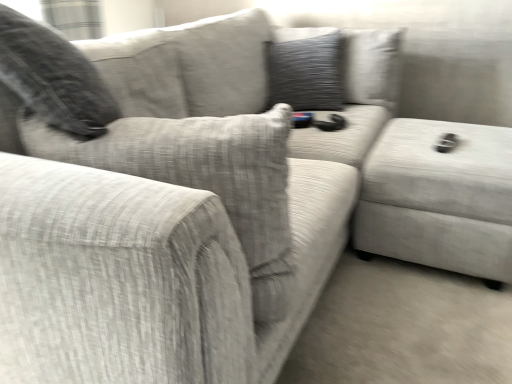
Question: From the image's perspective, is textured gray pillow at upper center beneath textured fabric ottoman at right?

Choices:
 (A) no
 (B) yes

Answer: (A)

Question: Does textured gray pillow at upper center have a greater height compared to textured fabric ottoman at right?

Choices:
 (A) no
 (B) yes

Answer: (B)

Question: Is textured gray pillow at upper center oriented away from textured fabric ottoman at right?

Choices:
 (A) yes
 (B) no

Answer: (B)

Question: Is textured gray pillow at upper center surrounding textured fabric ottoman at right?

Choices:
 (A) no
 (B) yes

Answer: (A)

Question: Does textured gray pillow at upper center have a smaller size compared to textured fabric ottoman at right?

Choices:
 (A) yes
 (B) no

Answer: (A)

Question: Could you tell me if textured gray pillow at upper center is facing textured fabric ottoman at right?

Choices:
 (A) no
 (B) yes

Answer: (A)

Question: Is textured fabric ottoman at right taller than textured gray pillow at upper center?

Choices:
 (A) yes
 (B) no

Answer: (B)

Question: From a real-world perspective, is textured fabric ottoman at right located beneath textured gray pillow at upper center?

Choices:
 (A) no
 (B) yes

Answer: (B)

Question: Can you confirm if textured fabric ottoman at right is smaller than textured gray pillow at upper center?

Choices:
 (A) no
 (B) yes

Answer: (A)

Question: Is textured fabric ottoman at right positioned with its back to textured gray pillow at upper center?

Choices:
 (A) yes
 (B) no

Answer: (B)

Question: Would you say textured fabric ottoman at right is a long distance from textured gray pillow at upper center?

Choices:
 (A) no
 (B) yes

Answer: (A)

Question: Does textured fabric ottoman at right have a greater width compared to textured gray pillow at upper center?

Choices:
 (A) yes
 (B) no

Answer: (A)

Question: Considering the relative positions of textured fabric ottoman at right and textured gray pillow at upper center in the image provided, is textured fabric ottoman at right to the left or to the right of textured gray pillow at upper center?

Choices:
 (A) left
 (B) right

Answer: (B)